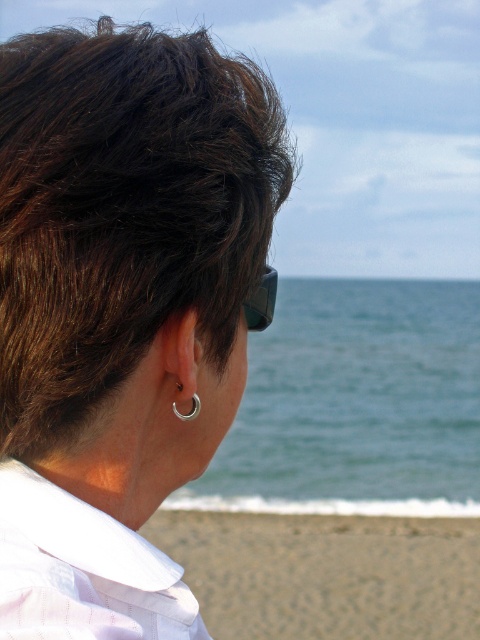
Question: Which point appears closest to the camera in this image?

Choices:
 (A) (254, 301)
 (B) (466, 609)
 (C) (432, 317)

Answer: (A)

Question: Does sandy beach at lower right have a larger size compared to silver/polished metal earring at center-left?

Choices:
 (A) yes
 (B) no

Answer: (A)

Question: Does white striped shirt at center have a lesser width compared to silver/polished metal earring at center-left?

Choices:
 (A) no
 (B) yes

Answer: (A)

Question: Is dark brown hair at center thinner than white striped shirt at center?

Choices:
 (A) no
 (B) yes

Answer: (A)

Question: Which object is farther from the camera taking this photo?

Choices:
 (A) dark brown hair at center
 (B) matte black goggles at upper center
 (C) blue water at center
 (D) silver metallic ring at ear

Answer: (C)

Question: Which point appears farthest from the camera in this image?

Choices:
 (A) (323, 456)
 (B) (256, 330)
 (C) (145, 589)

Answer: (A)